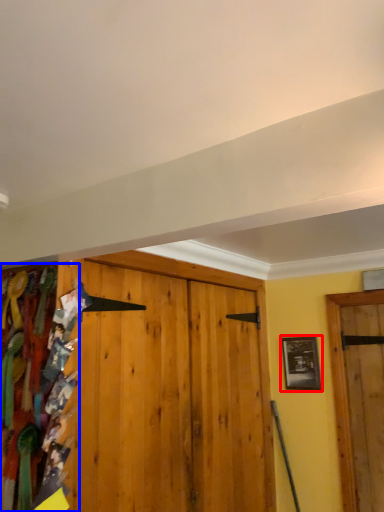
Question: Which object appears closest to the camera in this image, picture frame (highlighted by a red box) or textile (highlighted by a blue box)?

Choices:
 (A) picture frame
 (B) textile

Answer: (B)